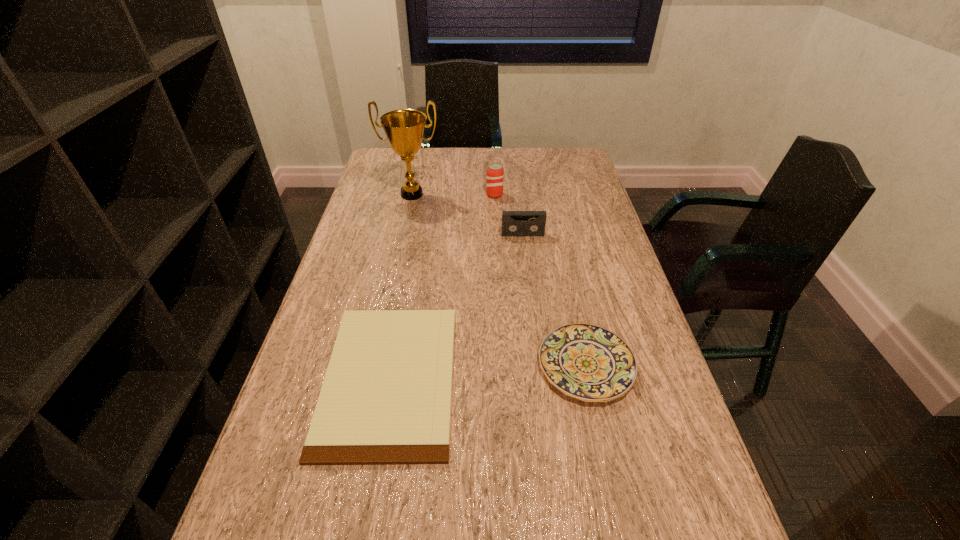
Where is `vacant position located on the right of the clipboard`? The image size is (960, 540). vacant position located on the right of the clipboard is located at coordinates (551, 377).

Locate an element on the screen. award present at the left edge is located at coordinates (404, 128).

Where is `clipboard that is at the left edge`? The image size is (960, 540). clipboard that is at the left edge is located at coordinates (386, 397).

Locate an element on the screen. Image resolution: width=960 pixels, height=540 pixels. object at the right edge is located at coordinates (588, 362).

Image resolution: width=960 pixels, height=540 pixels. What are the coordinates of `vacant space at the far edge of the desktop` in the screenshot? It's located at (476, 153).

In the image, there is a desktop. Identify the location of vacant space at the left edge. (373, 233).

This screenshot has width=960, height=540. Identify the location of free space at the right edge of the desktop. (684, 423).

Identify the location of vacant space at the far right corner of the desktop. (585, 177).

Identify the location of vacant space in between the fourth tallest object and the videotape. The width and height of the screenshot is (960, 540). (554, 300).

Find the location of a particular element. vacant point located between the clipboard and the second shortest object is located at coordinates (488, 372).